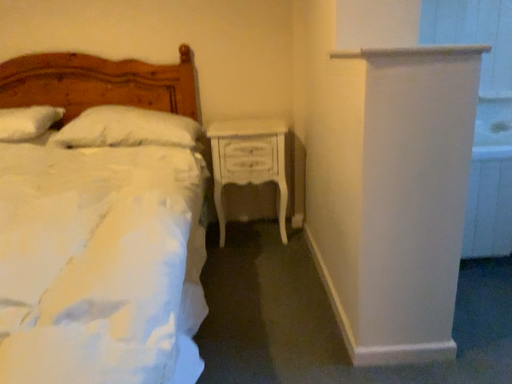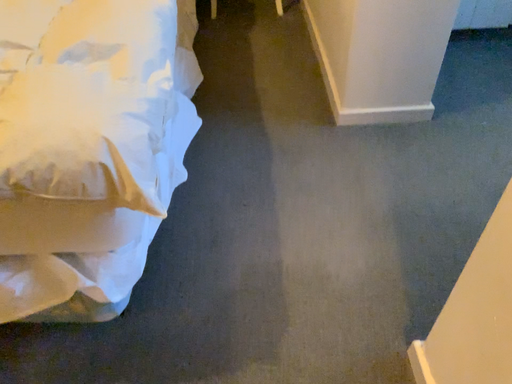
Question: Which way did the camera rotate in the video?

Choices:
 (A) rotated upward
 (B) rotated downward

Answer: (B)